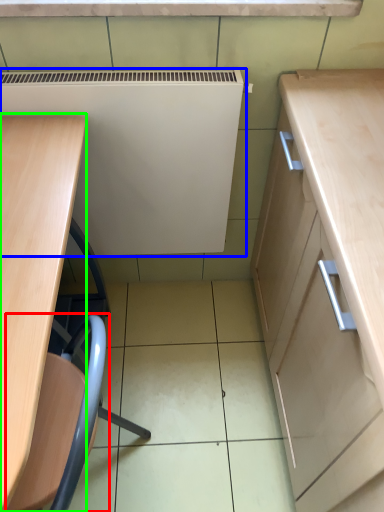
Question: Based on their relative distances, which object is nearer to swivel chair (highlighted by a red box)? Choose from appliance (highlighted by a blue box) and desk (highlighted by a green box).

Choices:
 (A) appliance
 (B) desk

Answer: (B)